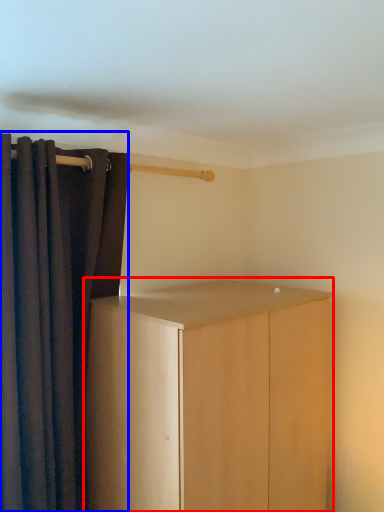
Question: Which object is further to the camera taking this photo, cupboard (highlighted by a red box) or curtain (highlighted by a blue box)?

Choices:
 (A) cupboard
 (B) curtain

Answer: (B)